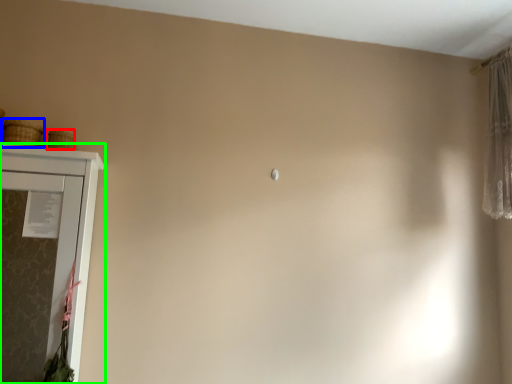
Question: Based on their relative distances, which object is nearer to basket (highlighted by a red box)? Choose from basket (highlighted by a blue box) and cupboard (highlighted by a green box).

Choices:
 (A) basket
 (B) cupboard

Answer: (A)